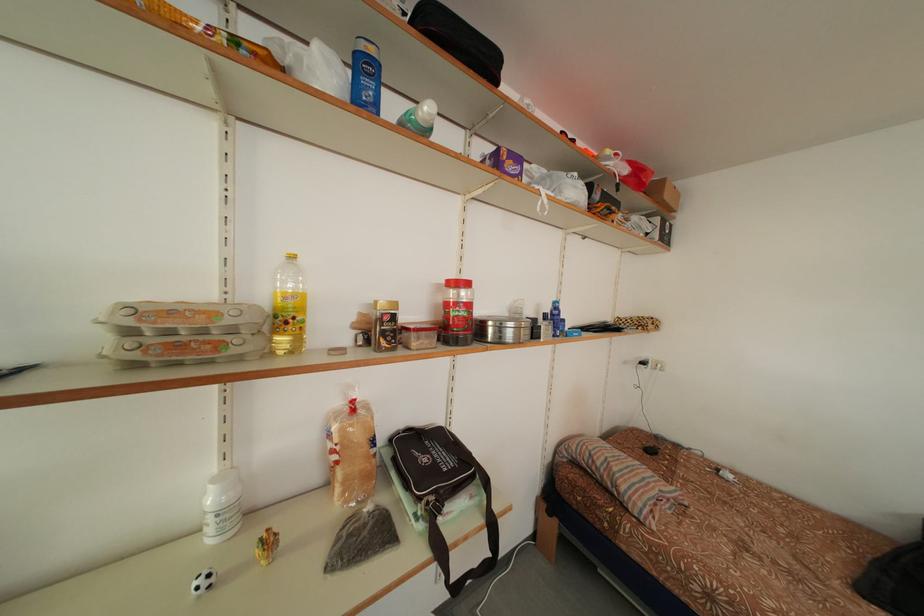
Find the location of a particular element. The image size is (924, 616). white wall plug is located at coordinates (650, 363).